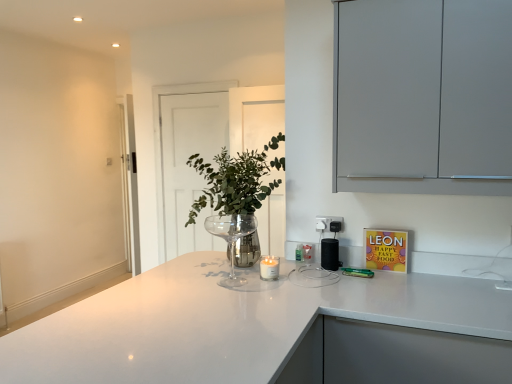
Locate an element on the screen. free spot above transparent glass door at center (from a real-world perspective) is located at coordinates (192, 91).